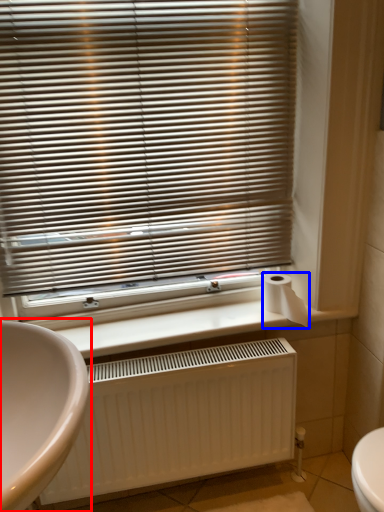
Question: Which of the following is the closest to the observer, sink (highlighted by a red box) or toilet paper (highlighted by a blue box)?

Choices:
 (A) sink
 (B) toilet paper

Answer: (A)